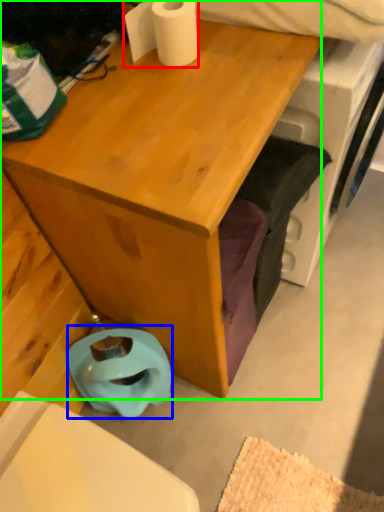
Question: Based on their relative distances, which object is farther from toilet paper (highlighted by a red box)? Choose from toilet bowl (highlighted by a blue box) and desk (highlighted by a green box).

Choices:
 (A) toilet bowl
 (B) desk

Answer: (A)